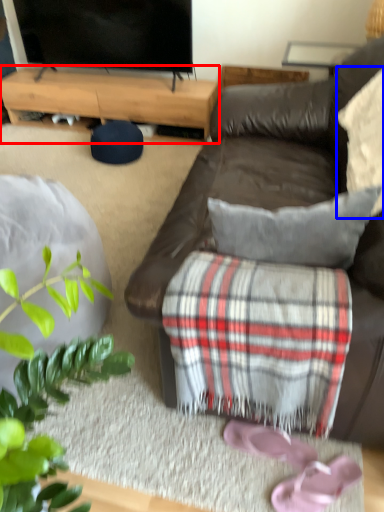
Question: Among these objects, which one is nearest to the camera, desk (highlighted by a red box) or pillow (highlighted by a blue box)?

Choices:
 (A) desk
 (B) pillow

Answer: (B)